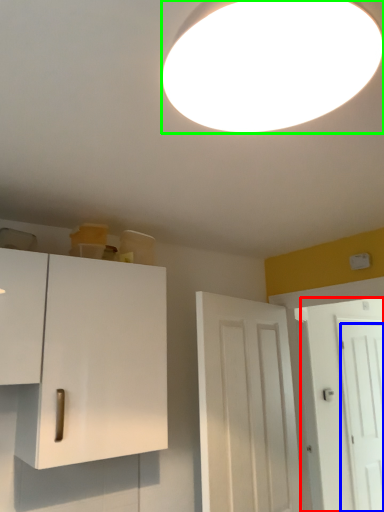
Question: Which is nearer to the door (highlighted by a red box)? door (highlighted by a blue box) or lamp (highlighted by a green box).

Choices:
 (A) door
 (B) lamp

Answer: (A)